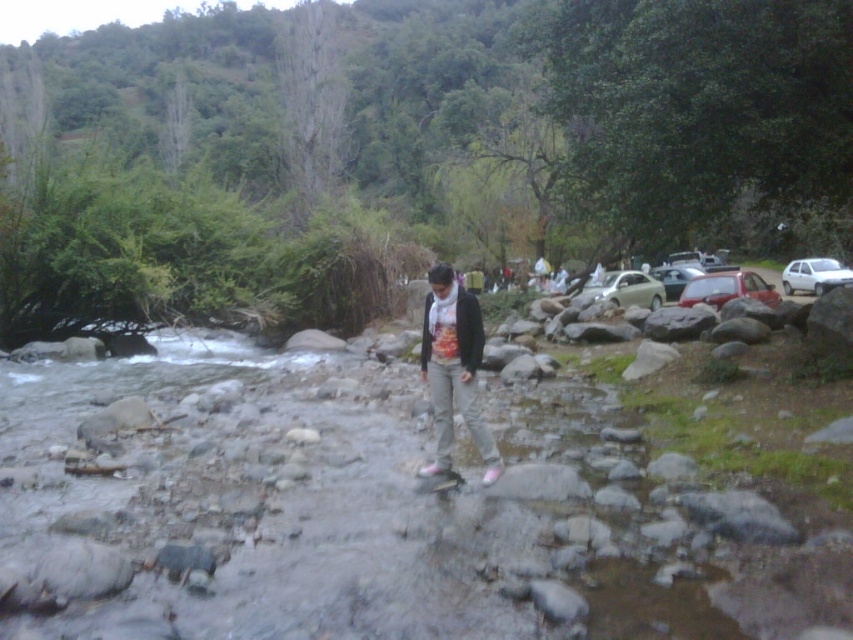
Is metallic red car at right closer to camera compared to metallic silver car at right?

Yes, it is.

Which is behind, point (722, 294) or point (677, 291)?

Positioned behind is point (677, 291).

Who is more distant from viewer, (718, 273) or (679, 284)?

Point (718, 273)

Identify the location of metallic red car at right. This screenshot has height=640, width=853. (727, 289).

Is metallic red car at right thinner than satin beige car at right?

No, metallic red car at right is not thinner than satin beige car at right.

Is metallic red car at right in front of satin beige car at right?

Yes, metallic red car at right is closer to the viewer.

Where is `metallic red car at right`? metallic red car at right is located at coordinates click(x=727, y=289).

Who is taller, printed cotton shirt at center or metallic silver car at right?

With more height is printed cotton shirt at center.

Which is below, printed cotton shirt at center or metallic silver car at right?

printed cotton shirt at center

Locate an element on the screen. This screenshot has width=853, height=640. printed cotton shirt at center is located at coordinates (453, 368).